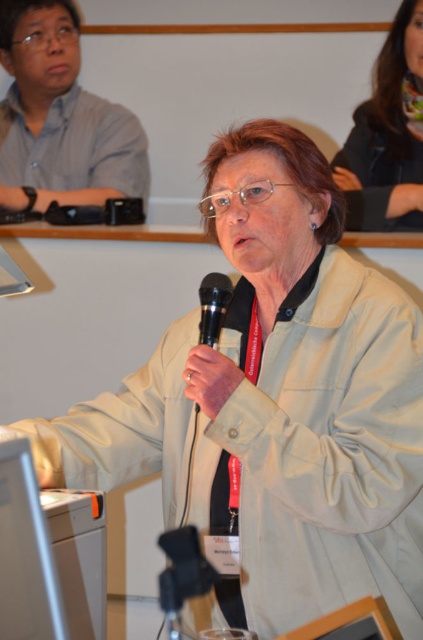
You are standing in a conference room and want to place a small plant on the floor at point (368, 113). The plant requires at least 8 feet of space from any obstacles. Is the location suitable?

The distance of point (368, 113) from camera is 9.15 feet, so yes, the location is suitable because it meets the required 8 feet distance from obstacles.

You are an event organizer who needs to arrange seating for a panel discussion. You see the dark brown leather jacket at upper right and the matte gray shirt at upper left in the image. Which attendee should you approach first if you need to adjust their seating position to the front row?

You should approach the matte gray shirt at upper left first because the dark brown leather jacket at upper right is behind it. Moving the matte gray shirt at upper left forward would allow the person behind to move forward as well.